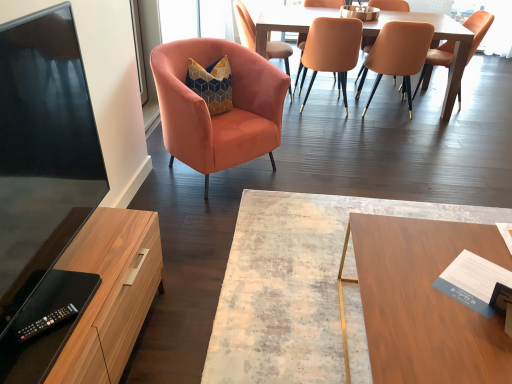
Where is `unoccupied space behind black plastic remote control at lower left`? The height and width of the screenshot is (384, 512). unoccupied space behind black plastic remote control at lower left is located at coordinates (89, 276).